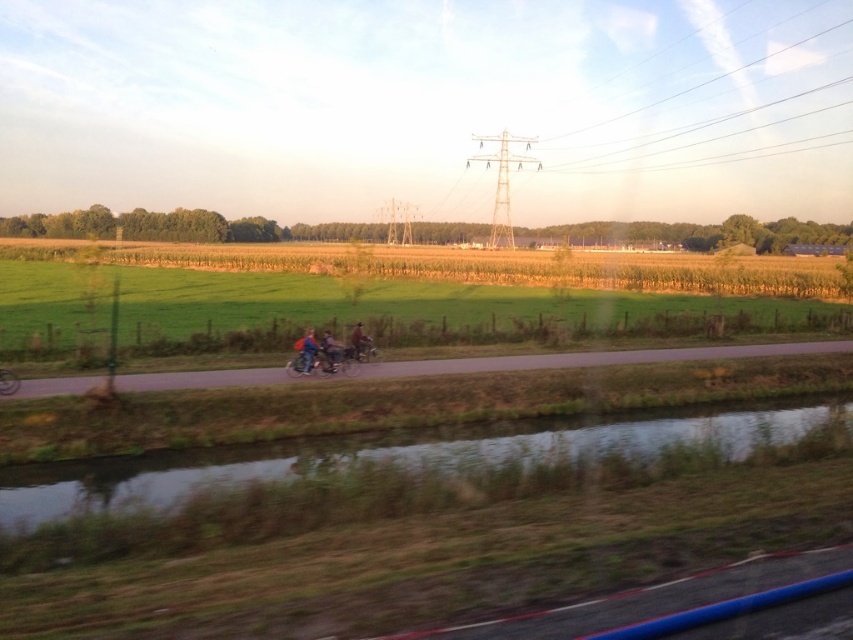
Measure the distance between green grass field at center and green grassy water at lower center.

green grass field at center is 110.98 feet from green grassy water at lower center.

Who is lower down, green grass field at center or green grassy water at lower center?

green grassy water at lower center is below.

Is point (294, 307) positioned before point (492, 442)?

No, it is behind (492, 442).

The height and width of the screenshot is (640, 853). What are the coordinates of `green grass field at center` in the screenshot? It's located at (376, 298).

Is green grass field at center closer to camera compared to shiny metallic motorcycle at center?

No, green grass field at center is further to the viewer.

Can you confirm if green grass field at center is smaller than shiny metallic motorcycle at center?

Actually, green grass field at center might be larger than shiny metallic motorcycle at center.

This screenshot has width=853, height=640. Identify the location of green grass field at center. (376, 298).

Which of these two, green grassy water at lower center or shiny metallic motorcycle at center, stands taller?

With more height is green grassy water at lower center.

Is green grassy water at lower center bigger than shiny metallic motorcycle at center?

Indeed, green grassy water at lower center has a larger size compared to shiny metallic motorcycle at center.

Locate an element on the screen. green grassy water at lower center is located at coordinates (403, 458).

This screenshot has height=640, width=853. Find the location of `green grassy water at lower center`. green grassy water at lower center is located at coordinates (403, 458).